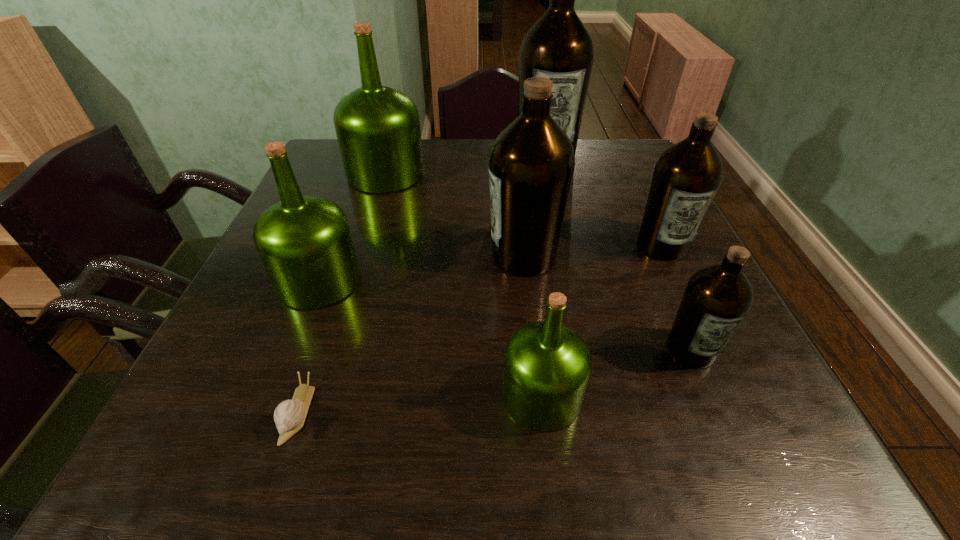
Where is `escargot that is at the near edge`? Image resolution: width=960 pixels, height=540 pixels. escargot that is at the near edge is located at coordinates (289, 416).

Identify the location of object located at the far left corner. (378, 130).

This screenshot has width=960, height=540. Find the location of `free space at the far edge of the desktop`. free space at the far edge of the desktop is located at coordinates (587, 160).

In the image, there is a desktop. At what (x,y) coordinates should I click in order to perform the action: click on vacant space at the near edge. Please return your answer as a coordinate pair (x, y). This screenshot has height=540, width=960. Looking at the image, I should click on (349, 441).

Image resolution: width=960 pixels, height=540 pixels. In the image, there is a desktop. In order to click on vacant space at the right edge in this screenshot , I will do `click(632, 196)`.

You are a GUI agent. You are given a task and a screenshot of the screen. Output one action in this format:
    pyautogui.click(x=<x>, y=<y>)
    Task: Click on the blank space at the far left corner of the desktop
    The image size is (960, 540).
    Given the screenshot: What is the action you would take?
    pyautogui.click(x=317, y=172)

Identify the location of free region at the far right corner of the desktop. (642, 166).

Find the location of a particular element. vacant space in between the third smallest brown olive oil and the nearest brown olive oil is located at coordinates (608, 302).

The width and height of the screenshot is (960, 540). Find the location of `free space between the smallest brown olive oil and the nearest green olive oil`. free space between the smallest brown olive oil and the nearest green olive oil is located at coordinates click(616, 373).

Locate an element on the screen. The width and height of the screenshot is (960, 540). unoccupied area between the nearest green olive oil and the biggest green olive oil is located at coordinates (464, 285).